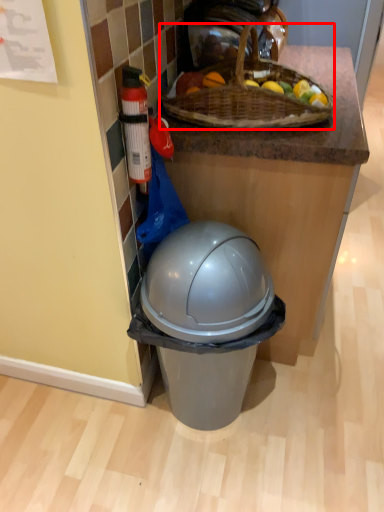
Question: In this image, where is picnic basket (annotated by the red box) located relative to bottle?

Choices:
 (A) right
 (B) left

Answer: (A)